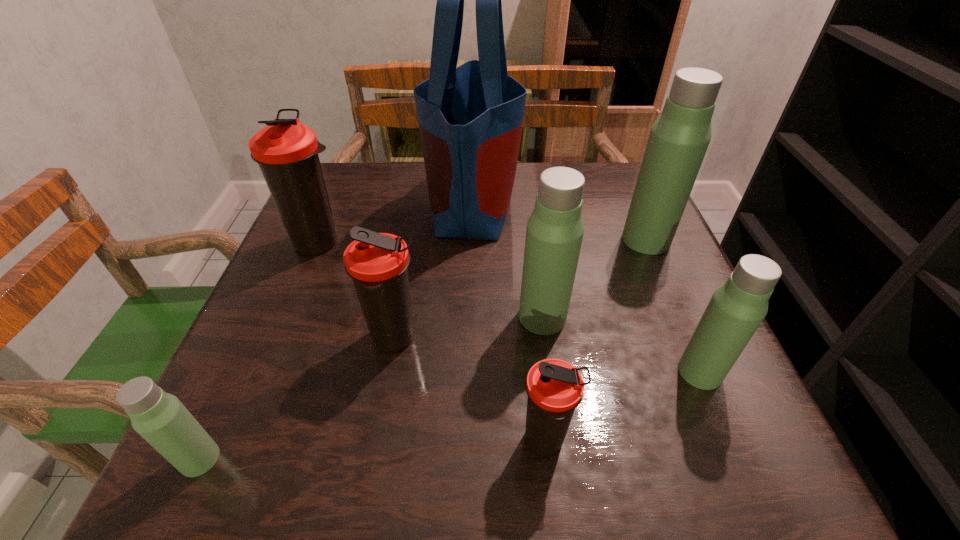
What are the coordinates of `red handbag` in the screenshot? It's located at (470, 118).

The width and height of the screenshot is (960, 540). I want to click on handbag, so pos(470,118).

Identify the location of the biggest light thermos bottle. The height and width of the screenshot is (540, 960). (679, 138).

The height and width of the screenshot is (540, 960). In order to click on the farthest light thermos bottle in this screenshot , I will do pos(679,138).

Locate an element on the screen. The image size is (960, 540). the leftmost brown thermos bottle is located at coordinates pos(286,151).

Find the location of a particular element. This screenshot has width=960, height=540. the biggest brown thermos bottle is located at coordinates (286, 151).

I want to click on the second light thermos bottle from left to right, so click(555, 229).

Image resolution: width=960 pixels, height=540 pixels. I want to click on the third nearest light thermos bottle, so [555, 229].

Where is `the second brown thermos bottle from left to right`? This screenshot has height=540, width=960. the second brown thermos bottle from left to right is located at coordinates (378, 263).

Image resolution: width=960 pixels, height=540 pixels. Find the location of `the second nearest brown thermos bottle`. the second nearest brown thermos bottle is located at coordinates (378, 263).